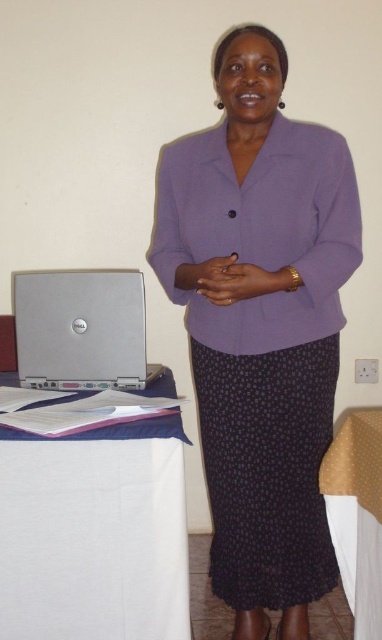
Can you confirm if white cloth at lower left is smaller than dark polka dot skirt at center?

Yes, white cloth at lower left is smaller than dark polka dot skirt at center.

Find the location of a particular element. white cloth at lower left is located at coordinates (93, 534).

Is purple matte blazer at center positioned at the back of gold fabric tablecloth at lower right?

That is True.

Who is more distant from viewer, (236,74) or (359,630)?

The point (359,630) is behind.

Is point (199, 148) closer to viewer compared to point (362, 420)?

No.

Locate an element on the screen. purple matte blazer at center is located at coordinates 260,324.

The height and width of the screenshot is (640, 382). Describe the element at coordinates (267, 470) in the screenshot. I see `dark polka dot skirt at center` at that location.

Can you confirm if dark polka dot skirt at center is thinner than silver metallic laptop at lower left?

Correct, dark polka dot skirt at center's width is less than silver metallic laptop at lower left's.

Locate an element on the screen. This screenshot has height=640, width=382. dark polka dot skirt at center is located at coordinates (267, 470).

Locate an element on the screen. The width and height of the screenshot is (382, 640). dark polka dot skirt at center is located at coordinates (267, 470).